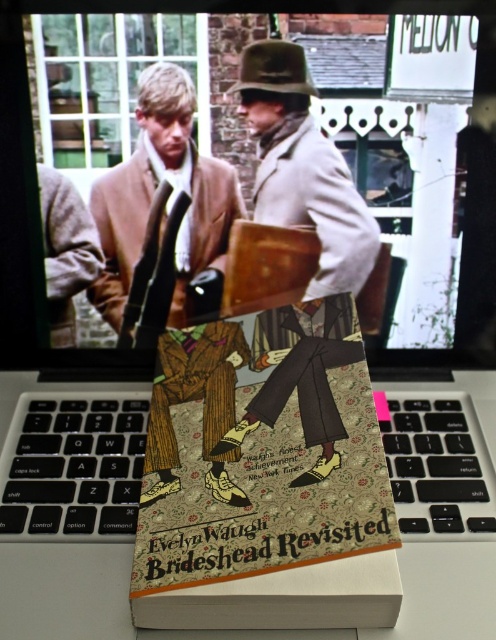
Question: Is light beige wool coat at center closer to camera compared to matte brown coat at center?

Choices:
 (A) yes
 (B) no

Answer: (A)

Question: Which point is farther from the camera taking this photo?

Choices:
 (A) click(145, 492)
 (B) click(152, 109)

Answer: (B)

Question: Estimate the real-world distances between objects in this image. Which object is closer to the wooden figure at center?

Choices:
 (A) patterned paper book at center
 (B) light beige wool coat at center

Answer: (B)

Question: Is matte brown coat at center below patterned paper book at center?

Choices:
 (A) no
 (B) yes

Answer: (A)

Question: Is patterned paper book at center wider than wooden figure at center?

Choices:
 (A) no
 (B) yes

Answer: (B)

Question: Which point is farther to the camera?

Choices:
 (A) patterned paper book at center
 (B) wooden figure at center

Answer: (B)